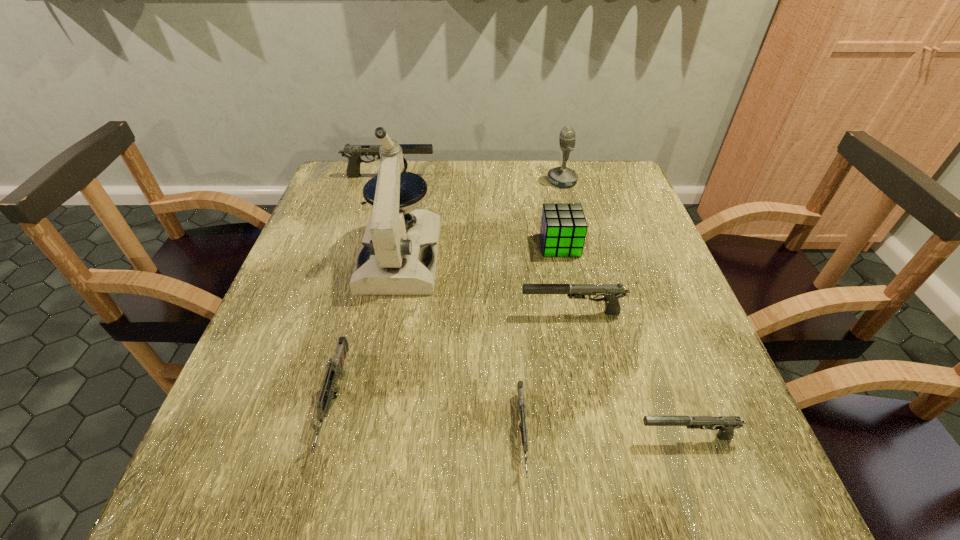
This screenshot has width=960, height=540. In order to click on object situated at the far right corner in this screenshot , I will do [562, 176].

In the image, there is a desktop. At what (x,y) coordinates should I click in order to perform the action: click on free space at the far edge. Please return your answer as a coordinate pair (x, y). Looking at the image, I should click on (534, 205).

The height and width of the screenshot is (540, 960). What are the coordinates of `vacant region at the near edge` in the screenshot? It's located at (331, 463).

Locate an element on the screen. free space at the left edge is located at coordinates (295, 375).

At what (x,y) coordinates should I click in order to perform the action: click on free space at the right edge. Please return your answer as a coordinate pair (x, y). Looking at the image, I should click on (640, 236).

The width and height of the screenshot is (960, 540). In the image, there is a desktop. What are the coordinates of `vacant space at the far left corner` in the screenshot? It's located at coord(337,181).

Locate an element on the screen. free space at the near left corner of the desktop is located at coordinates (252, 464).

At what (x,y) coordinates should I click in order to perform the action: click on vacant area between the fifth farthest object and the cube. Please return your answer as a coordinate pair (x, y). Looking at the image, I should click on (566, 279).

You are a GUI agent. You are given a task and a screenshot of the screen. Output one action in this format:
    pyautogui.click(x=<x>, y=<y>)
    Task: Click on the free spot between the right grey gun and the fourth nearest gun
    
    Given the screenshot: What is the action you would take?
    pyautogui.click(x=547, y=374)

Identify the location of free point between the smallest gray gun and the left grey gun. This screenshot has width=960, height=540. (511, 420).